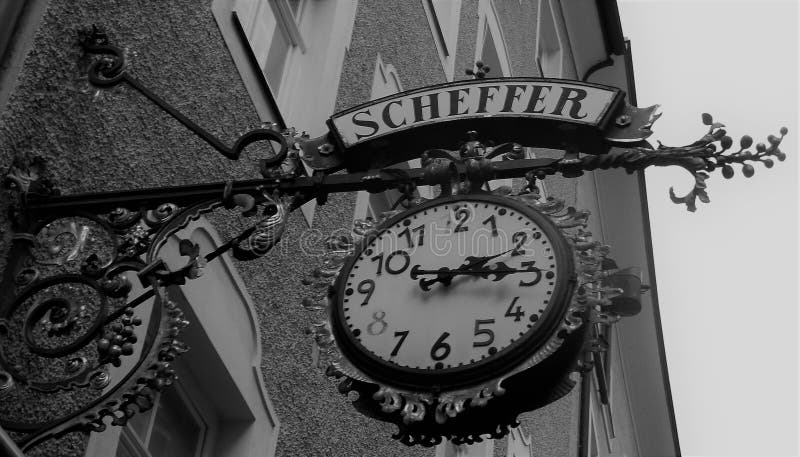
Where is `clock minute hand`? clock minute hand is located at coordinates (502, 267).